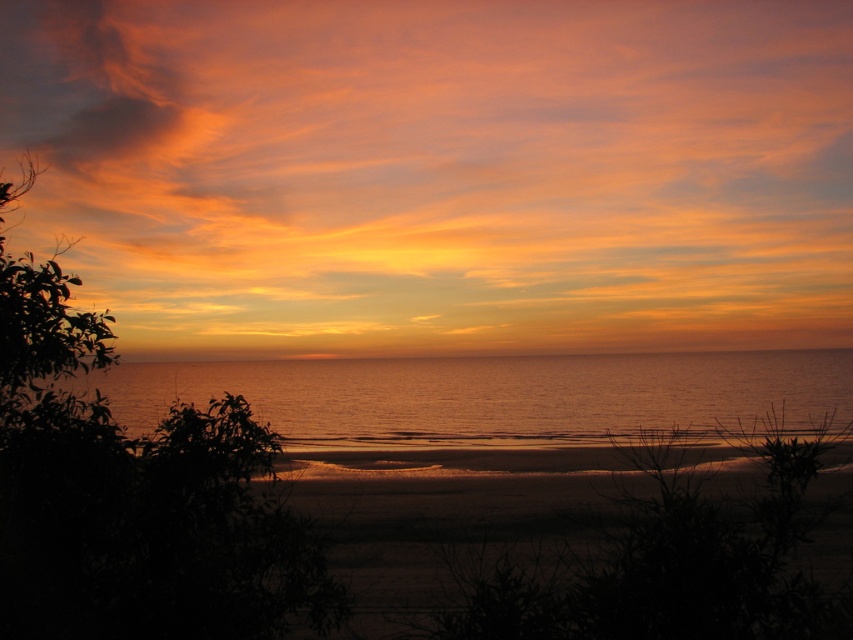
Is matte orange cloud at upper center to the right of silvery water at center from the viewer's perspective?

Correct, you'll find matte orange cloud at upper center to the right of silvery water at center.

Is point (625, 284) less distant than point (474, 428)?

That is False.

What do you see at coordinates (440, 172) in the screenshot? I see `matte orange cloud at upper center` at bounding box center [440, 172].

Locate an element on the screen. The height and width of the screenshot is (640, 853). matte orange cloud at upper center is located at coordinates (440, 172).